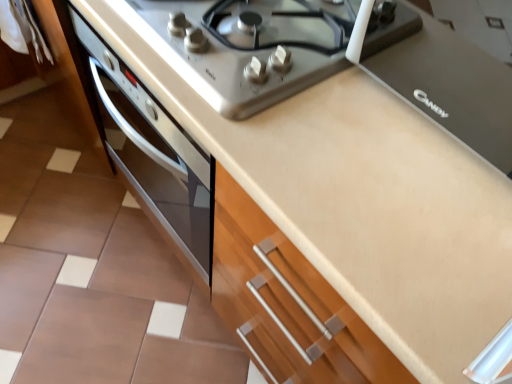
Locate an element on the screen. The image size is (512, 384). free location in front of black matte stove top at upper center is located at coordinates pos(413,238).